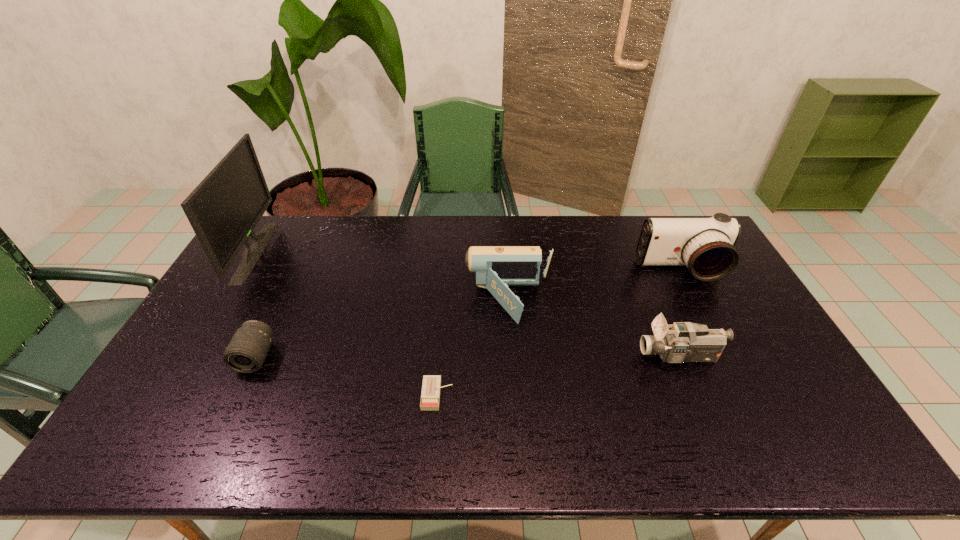
What are the coordinates of `the leftmost object` in the screenshot? It's located at point(223,210).

Image resolution: width=960 pixels, height=540 pixels. Find the location of `the tallest object`. the tallest object is located at coordinates (223, 210).

The height and width of the screenshot is (540, 960). Identify the location of the second tallest object. (705, 245).

Where is `the fourth object from left to right`? the fourth object from left to right is located at coordinates (496, 267).

Identify the location of the nearest camcorder. (686, 342).

At what (x,y) coordinates should I click in order to perform the action: click on the fifth object from right to left. Please return your answer as a coordinate pair (x, y). The width and height of the screenshot is (960, 540). Looking at the image, I should click on (246, 352).

Identify the location of the fifth tallest object. (246, 352).

Locate an element on the screen. This screenshot has width=960, height=540. the shortest object is located at coordinates (430, 397).

At what (x,y) coordinates should I click in order to perform the action: click on matchbox. Please return your answer as a coordinate pair (x, y). This screenshot has width=960, height=540. Looking at the image, I should click on (430, 397).

Where is `vacant region located on the front-facing side of the tallest object`? vacant region located on the front-facing side of the tallest object is located at coordinates (350, 252).